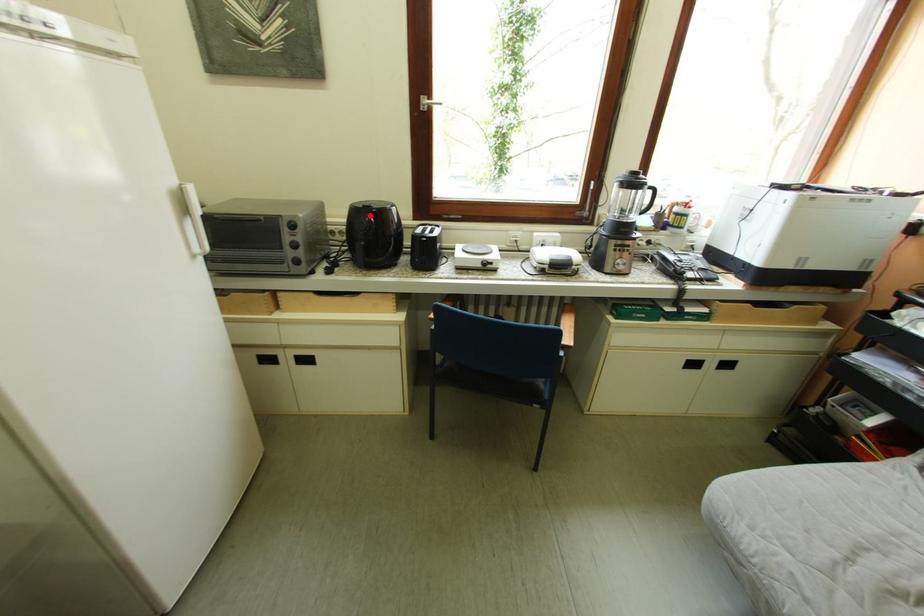
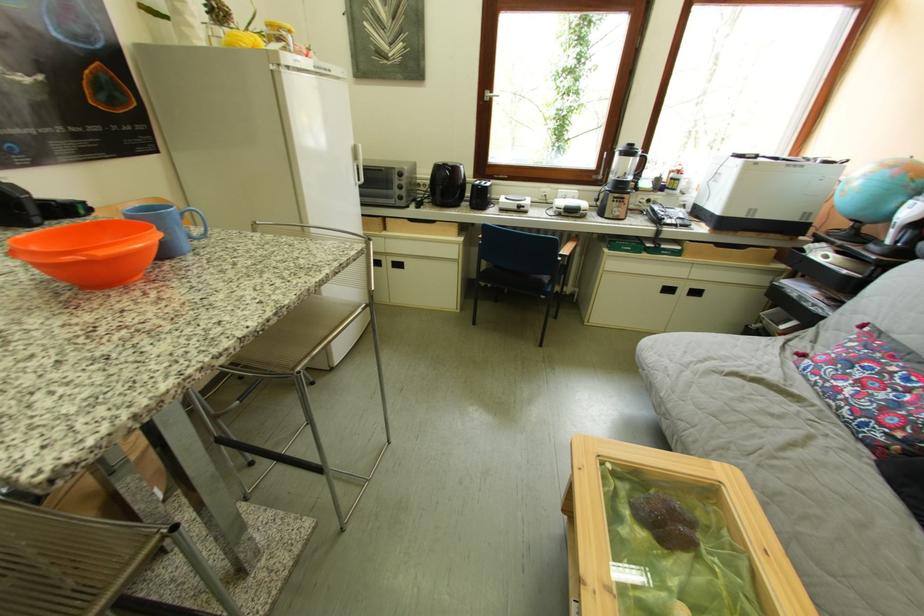
Where in the second image is the point corresponding to the highlighted location from the first image?

(451, 171)